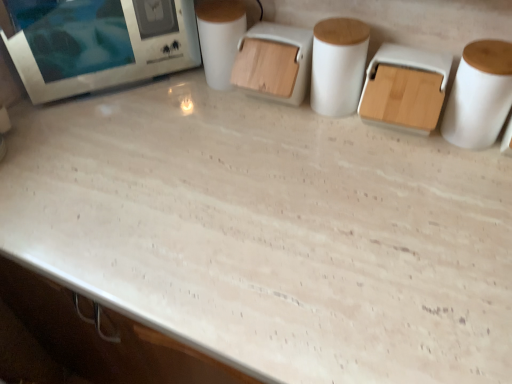
This screenshot has width=512, height=384. In order to click on vacant area that is in front of wooden lid container at center in this screenshot , I will do `click(281, 150)`.